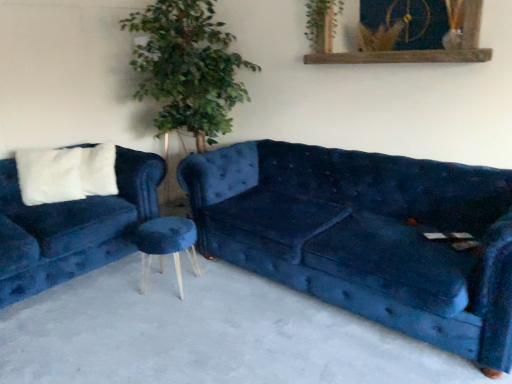
Question: From the image's perspective, is green leafy plant at upper center positioned above or below white fluffy pillow at left?

Choices:
 (A) below
 (B) above

Answer: (B)

Question: Is green leafy plant at upper center to the left or to the right of white fluffy pillow at left in the image?

Choices:
 (A) right
 (B) left

Answer: (A)

Question: Considering the real-world distances, which object is closest to the velvet blue stool at center?

Choices:
 (A) velvet blue couch at left, which is the first studio couch from left to right
 (B) velvet blue couch at center, which is the 1th studio couch from right to left
 (C) velvet blue couch at center
 (D) white fluffy pillow at left
 (E) rustic wood picture frame at upper center

Answer: (A)

Question: Which object is the closest to the velvet blue stool at center?

Choices:
 (A) rustic wood picture frame at upper center
 (B) white fluffy pillow at left
 (C) velvet blue couch at center, which is the 1th studio couch from right to left
 (D) velvet blue couch at center
 (E) green leafy plant at upper center

Answer: (D)